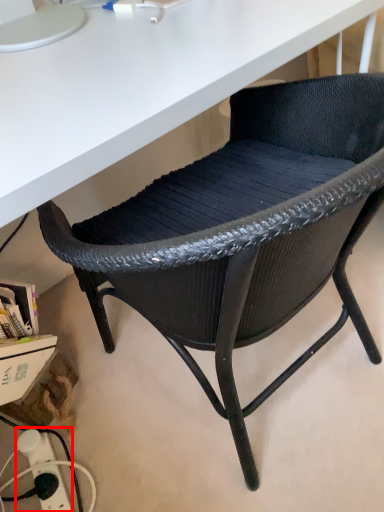
Question: From the image's perspective, where is electric outlet (annotated by the red box) located in relation to chair in the image?

Choices:
 (A) below
 (B) above

Answer: (A)